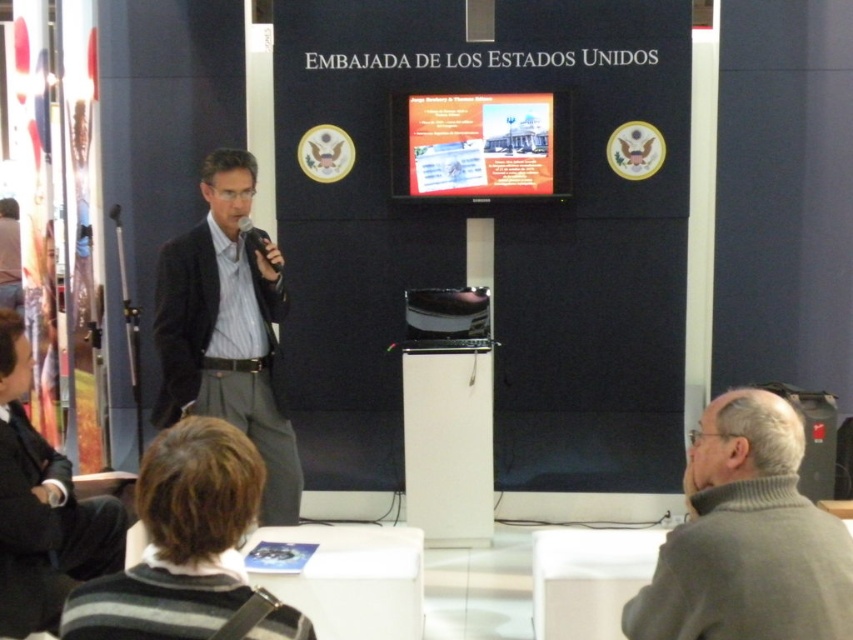
Question: Estimate the real-world distances between objects in this image. Which object is closer to the matte black suit at center?

Choices:
 (A) orange glossy poster at center
 (B) gray wool sweater at lower right
 (C) black plastic microphone at center
 (D) black fabric business suit at lower left

Answer: (C)

Question: Among these objects, which one is nearest to the camera?

Choices:
 (A) matte black suit at center
 (B) orange glossy poster at center
 (C) black plastic microphone at center

Answer: (A)

Question: Which object appears farthest from the camera in this image?

Choices:
 (A) gray wool sweater at lower right
 (B) matte black suit at center
 (C) black fabric business suit at lower left
 (D) black plastic microphone at center

Answer: (D)

Question: Is gray wool sweater at lower right wider than black fabric business suit at lower left?

Choices:
 (A) no
 (B) yes

Answer: (B)

Question: Can you confirm if gray wool sweater at lower right is thinner than black fabric business suit at lower left?

Choices:
 (A) yes
 (B) no

Answer: (B)

Question: Does matte black suit at center lie behind black plastic microphone at center?

Choices:
 (A) yes
 (B) no

Answer: (B)